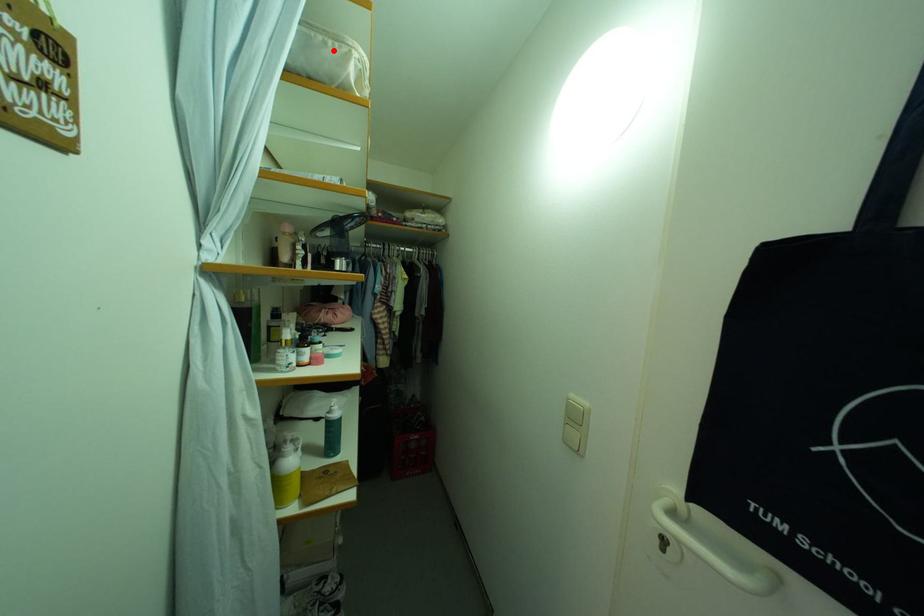
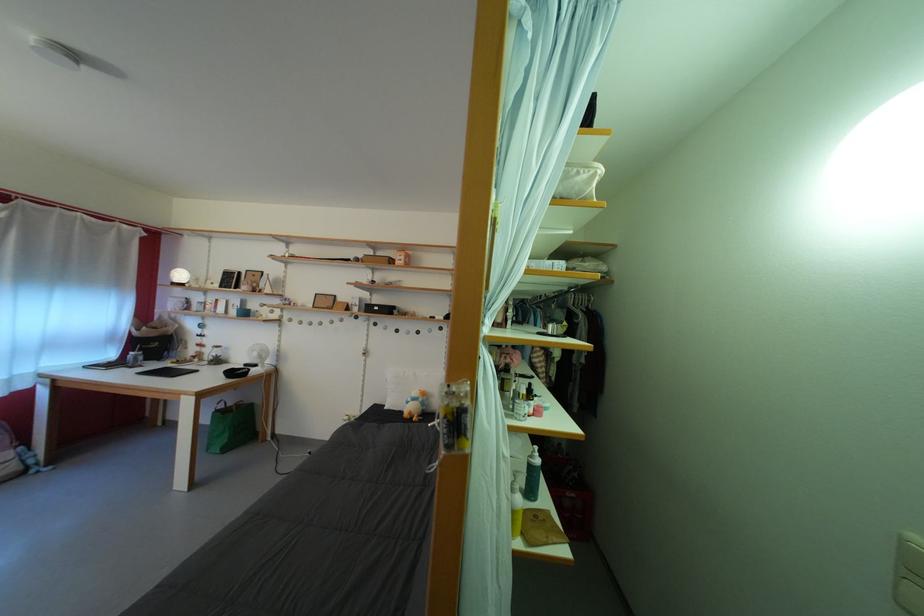
In the second image, find the point that corresponds to the highlighted location in the first image.

(587, 179)